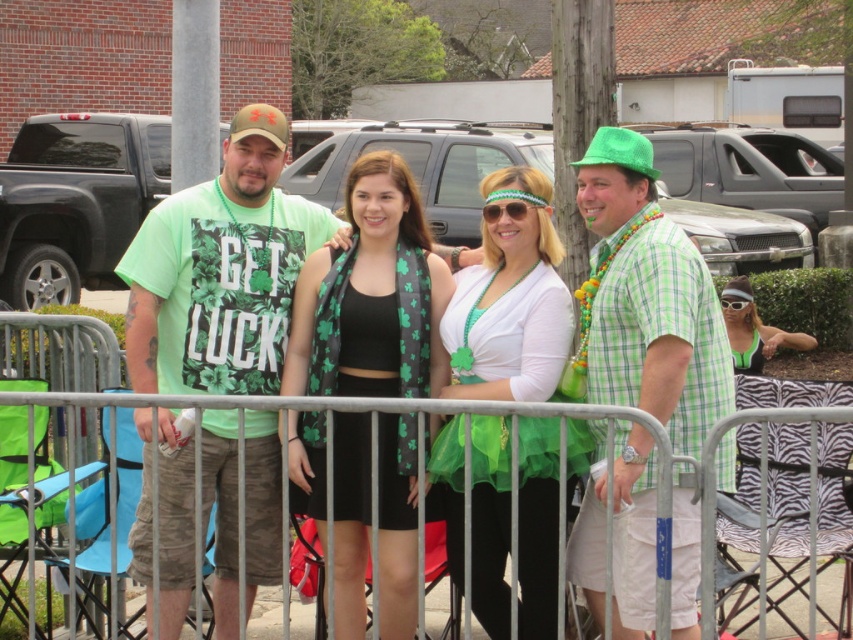
You are a photographer standing 1.5 meters away from the green plaid shirt at center. You want to take a photo of the metallic silver fence at center without moving. Can you reach it with your camera lens? The camera has a maximum focal length of 200mm and the minimum focusing distance is 1 meter.

The green plaid shirt at center is 2.15 meters away from the metallic silver fence at center. Since you are 1.5 meters away from the green plaid shirt, the total distance to the fence is 1.5m plus 2.15m equals 3.65 meters. The camera can focus as close as 1 meter, so yes, you can take the photo without moving.

You are a photographer trying to capture the group photo. The green plaid shirt at center and the metallic silver fence at center are both in the frame. Which object has a narrower width?

The green plaid shirt at center is thinner than the metallic silver fence at center, so the green plaid shirt at center has a narrower width.